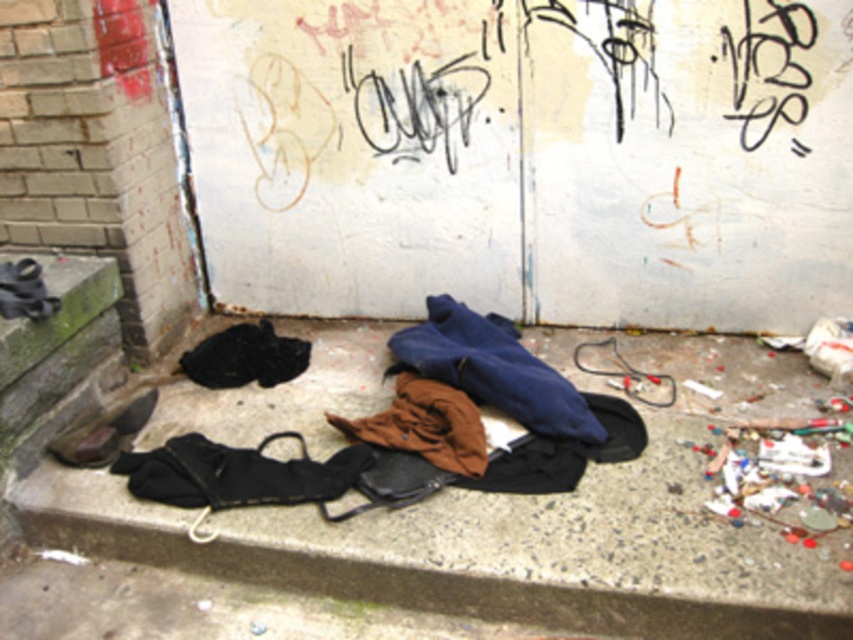
Question: In this image, where is blue cotton hoodie at center located relative to leather shoe at lower left?

Choices:
 (A) above
 (B) below

Answer: (A)

Question: Which point is closer to the camera?

Choices:
 (A) blue cotton hoodie at center
 (B) leather shoe at lower left

Answer: (A)

Question: Which of the following is the farthest from the observer?

Choices:
 (A) blue cotton hoodie at center
 (B) leather shoe at lower left

Answer: (B)

Question: From the image, what is the correct spatial relationship of blue cotton hoodie at center in relation to leather shoe at lower left?

Choices:
 (A) right
 (B) left

Answer: (A)

Question: Is blue cotton hoodie at center in front of leather shoe at lower left?

Choices:
 (A) yes
 (B) no

Answer: (A)